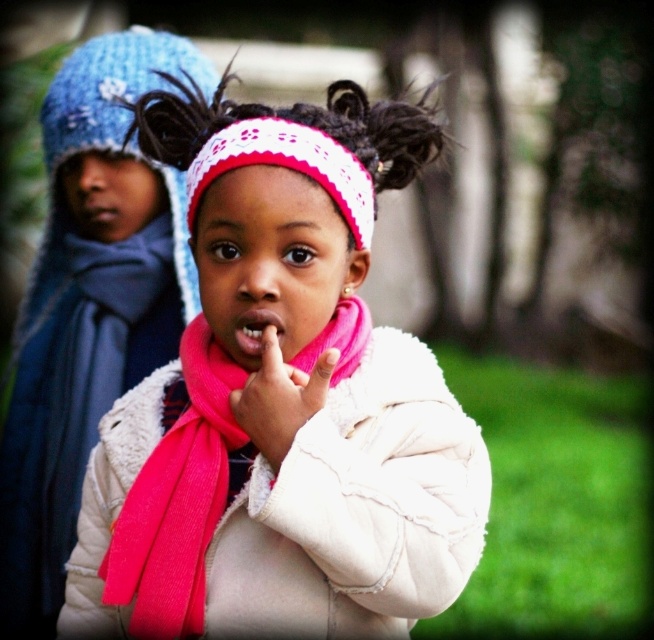
Question: Does pink fabric scarf at center appear on the left side of pink knitted headband at center?

Choices:
 (A) yes
 (B) no

Answer: (A)

Question: Observing the image, what is the correct spatial positioning of pink fleece scarf at upper center in reference to pink fabric hand at center?

Choices:
 (A) above
 (B) below

Answer: (A)

Question: Which point is closer to the camera?

Choices:
 (A) pink fleece scarf at upper center
 (B) pink fleece jacket at center
 (C) pink fabric scarf at center
 (D) pink knitted headband at center

Answer: (B)

Question: Does pink fabric scarf at center have a larger size compared to smooth pink lips at center?

Choices:
 (A) no
 (B) yes

Answer: (B)

Question: Which of the following is the closest to the observer?

Choices:
 (A) matte blue mouth at upper left
 (B) smooth pink lips at center

Answer: (B)

Question: Which object appears closest to the camera in this image?

Choices:
 (A) pink fabric hand at center
 (B) pink fleece jacket at center
 (C) smooth pink lips at center
 (D) pink knitted headband at center

Answer: (B)